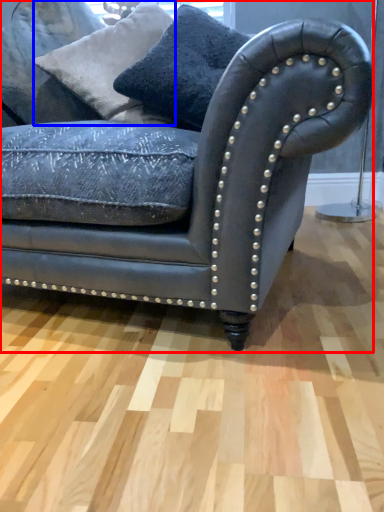
Question: Among these objects, which one is farthest to the camera, studio couch (highlighted by a red box) or pillow (highlighted by a blue box)?

Choices:
 (A) studio couch
 (B) pillow

Answer: (B)